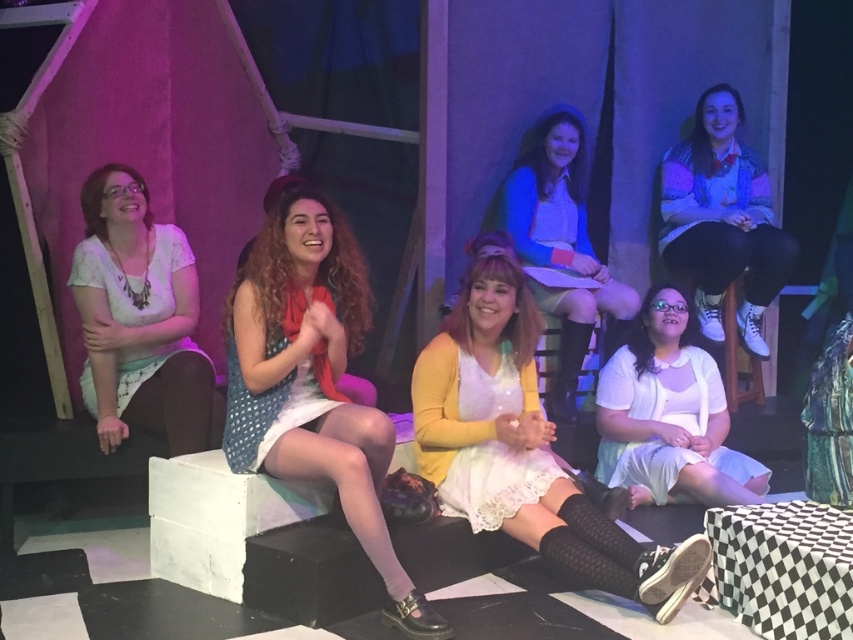
Question: Which point is closer to the camera?

Choices:
 (A) (473, 285)
 (B) (285, 282)
 (C) (717, 259)
 (D) (611, 468)

Answer: (B)

Question: Which object is the farthest from the polka dot fabric dress at center?

Choices:
 (A) yellow sweater at center
 (B) matte blue sweater at center

Answer: (B)

Question: Is matte blue sweater at upper right positioned at the back of matte blue sweater at center?

Choices:
 (A) yes
 (B) no

Answer: (A)

Question: Can you confirm if yellow sweater at center is positioned to the right of matte white blouse at left?

Choices:
 (A) yes
 (B) no

Answer: (A)

Question: Which of the following is the farthest from the observer?

Choices:
 (A) matte blue sweater at upper right
 (B) yellow sweater at center
 (C) matte blue sweater at center
 (D) polka dot fabric dress at center

Answer: (A)

Question: Is white satin dress at lower center behind matte blue sweater at upper right?

Choices:
 (A) no
 (B) yes

Answer: (A)